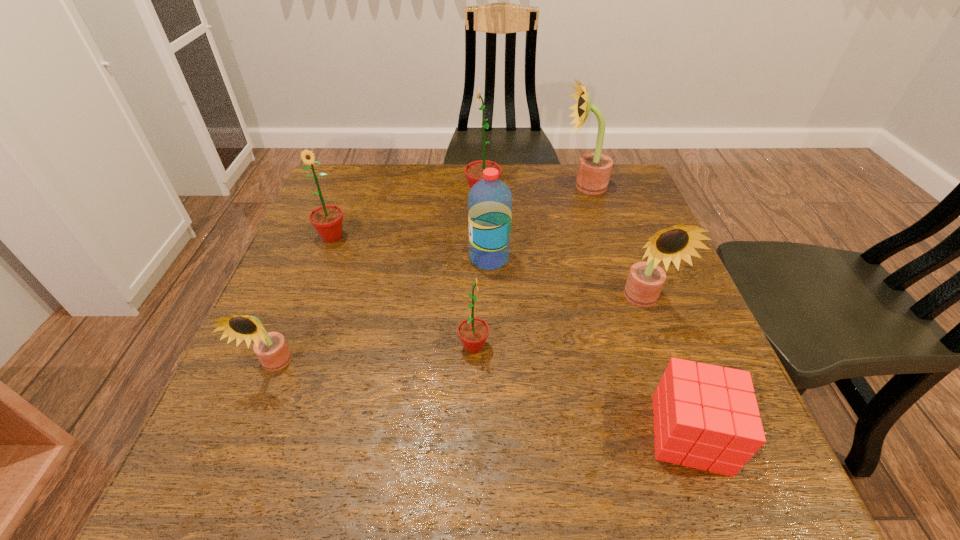
Locate an element on the screen. the biggest yellow sunflower is located at coordinates (594, 170).

In order to click on the farthest green sunflower in this screenshot , I will do pos(474,171).

Locate an element on the screen. the second smallest green sunflower is located at coordinates pyautogui.click(x=327, y=220).

Where is `the fourth nearest sunflower`? This screenshot has height=540, width=960. the fourth nearest sunflower is located at coordinates click(327, 220).

Where is `the second biggest yellow sunflower`? This screenshot has height=540, width=960. the second biggest yellow sunflower is located at coordinates click(x=645, y=281).

Identify the location of the fourth nearest object. The width and height of the screenshot is (960, 540). (645, 281).

Where is `water bottle`? Image resolution: width=960 pixels, height=540 pixels. water bottle is located at coordinates [x=490, y=200].

Where is `the smallest green sunflower`? the smallest green sunflower is located at coordinates (473, 332).

Locate an element on the screen. Image resolution: width=960 pixels, height=540 pixels. the nearest yellow sunflower is located at coordinates (271, 348).

At what (x,y) coordinates should I click in order to perform the action: click on the leftmost yellow sunflower. Please return your answer as a coordinate pair (x, y). Image resolution: width=960 pixels, height=540 pixels. Looking at the image, I should click on (271, 348).